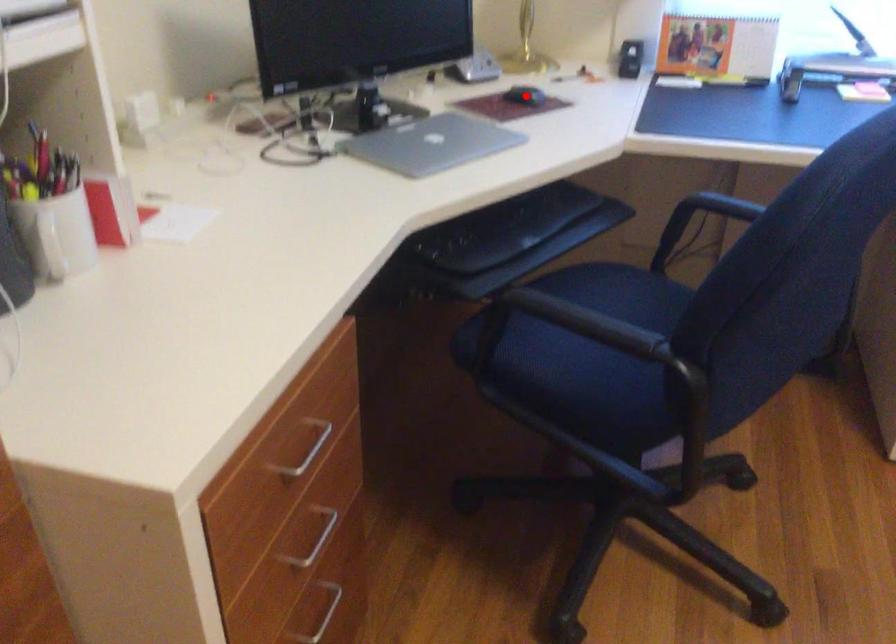
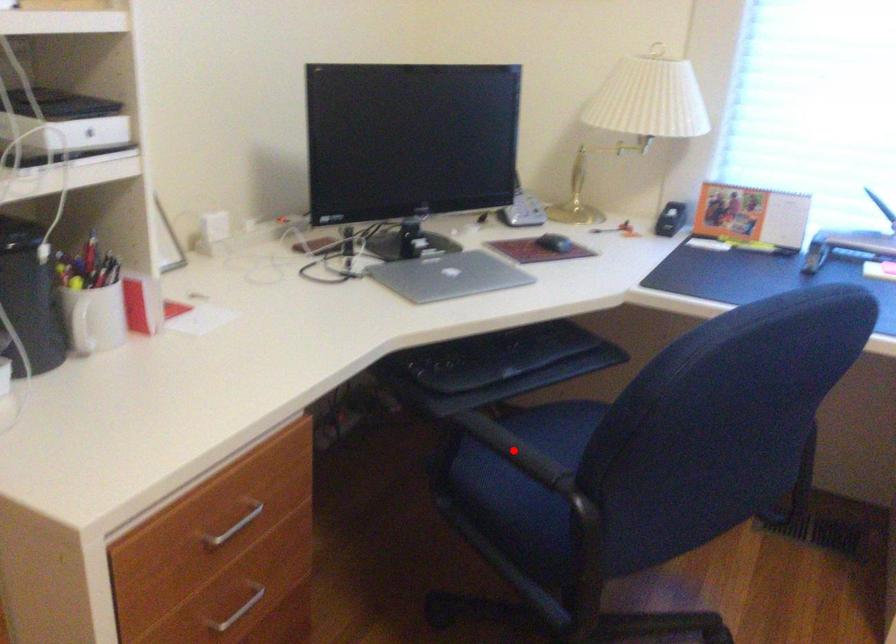
I am providing you with two images of the same scene from different viewpoints. A red point is marked on the first image and another point is marked on the second image. Is the marked point in image1 the same physical position as the marked point in image2?

No